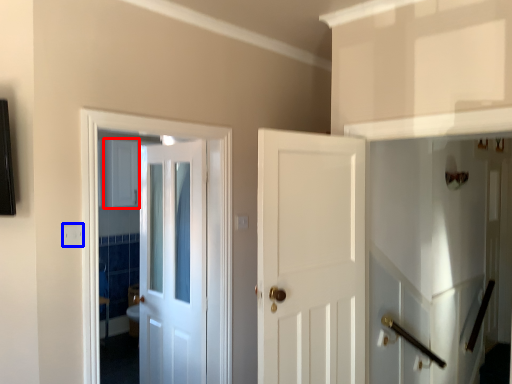
Question: Which point is closer to the camera, cabinetry (highlighted by a red box) or electric outlet (highlighted by a blue box)?

Choices:
 (A) cabinetry
 (B) electric outlet

Answer: (B)